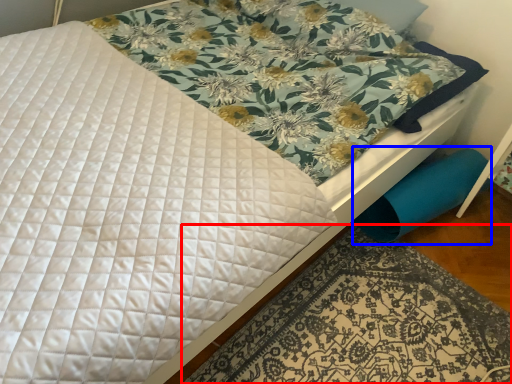
Question: Which point is further to the camera, mat (highlighted by a red box) or swivel chair (highlighted by a blue box)?

Choices:
 (A) mat
 (B) swivel chair

Answer: (B)